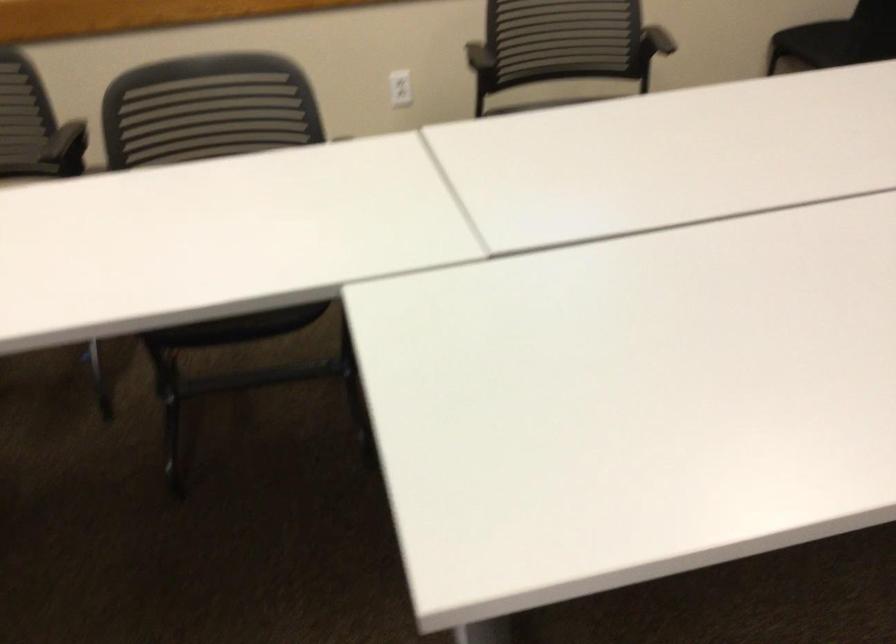
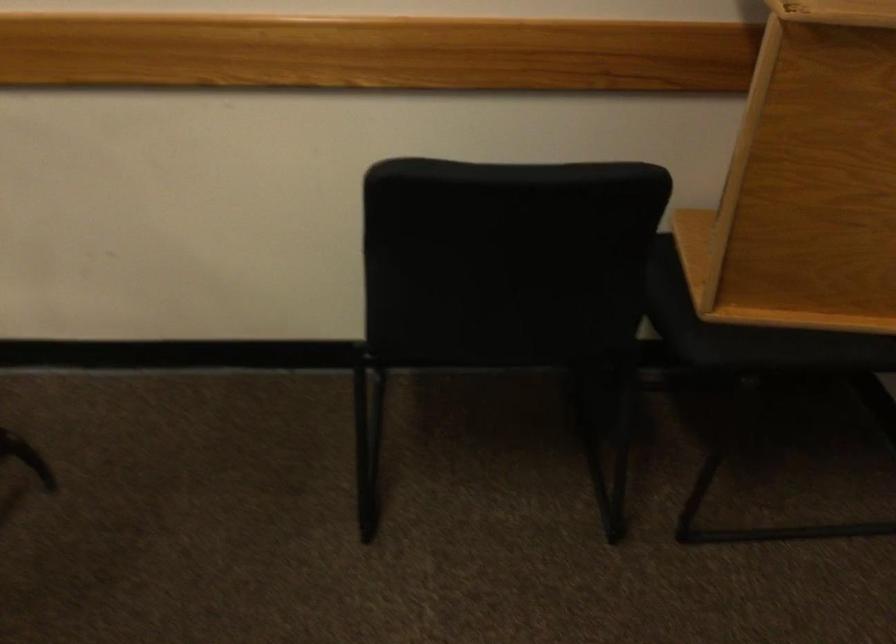
In the scene shown: Which direction would the cameraman need to move to produce the second image?

The movement direction of the cameraman is right, forward.